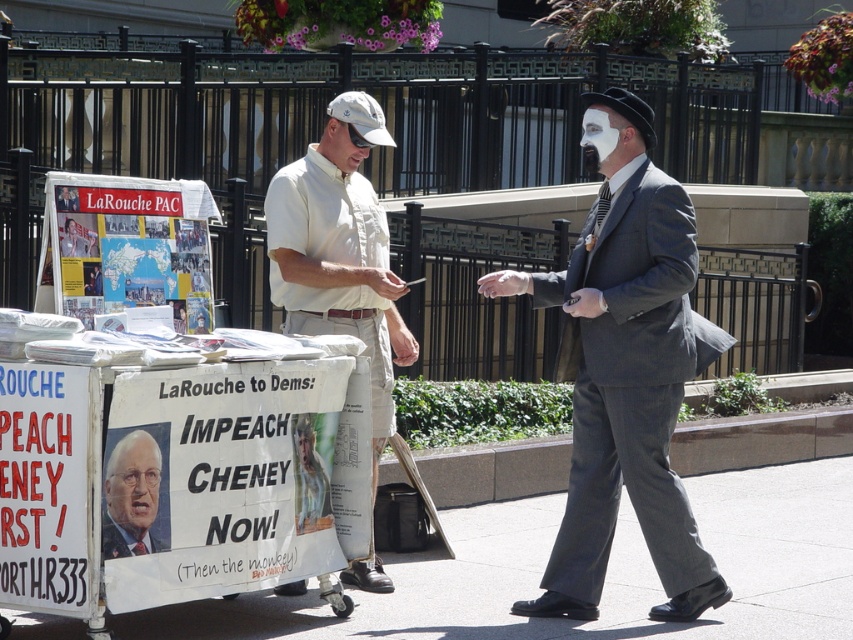
Can you confirm if light beige cotton shirt at center is positioned to the right of smooth plastic poster at center?

Indeed, light beige cotton shirt at center is positioned on the right side of smooth plastic poster at center.

Is light beige cotton shirt at center wider than smooth plastic poster at center?

Yes, light beige cotton shirt at center is wider than smooth plastic poster at center.

Which is behind, point (390, 387) or point (103, 499)?

The point (390, 387) is more distant.

At what (x,y) coordinates should I click in order to perform the action: click on light beige cotton shirt at center. Please return your answer as a coordinate pair (x, y). Looking at the image, I should click on (340, 250).

Is gray suit at center to the left of light beige cotton shirt at center from the viewer's perspective?

No, gray suit at center is not to the left of light beige cotton shirt at center.

Is gray suit at center above light beige cotton shirt at center?

Incorrect, gray suit at center is not positioned above light beige cotton shirt at center.

Find the location of `gray suit at center`. gray suit at center is located at coordinates (625, 371).

The image size is (853, 640). Describe the element at coordinates (605, 579) in the screenshot. I see `gray asphalt pavement at lower center` at that location.

Does gray asphalt pavement at lower center have a greater height compared to smooth plastic poster at center?

No.

Which is in front, point (778, 627) or point (115, 499)?

Positioned in front is point (115, 499).

This screenshot has width=853, height=640. I want to click on gray asphalt pavement at lower center, so click(x=605, y=579).